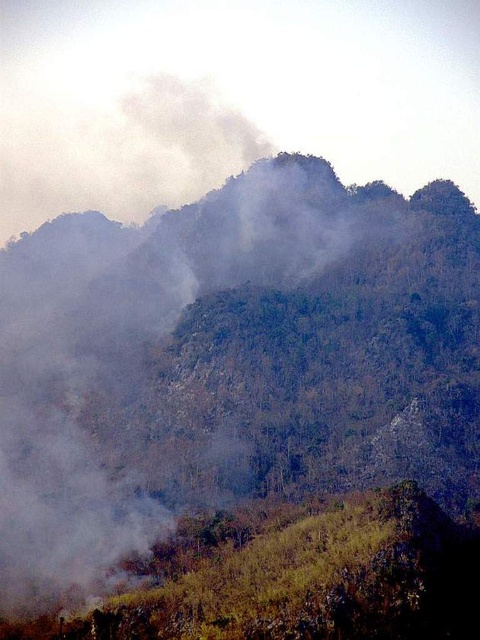
Question: Which object is farther from the camera taking this photo?

Choices:
 (A) white smoke at upper center
 (B) white smoke at center

Answer: (A)

Question: Does white smoke at center come behind white smoke at upper center?

Choices:
 (A) no
 (B) yes

Answer: (A)

Question: Is white smoke at center positioned before white smoke at upper center?

Choices:
 (A) no
 (B) yes

Answer: (B)

Question: Which point is closer to the camera taking this photo?

Choices:
 (A) (124, 202)
 (B) (70, 580)

Answer: (B)

Question: Does white smoke at center appear on the right side of white smoke at upper center?

Choices:
 (A) no
 (B) yes

Answer: (B)